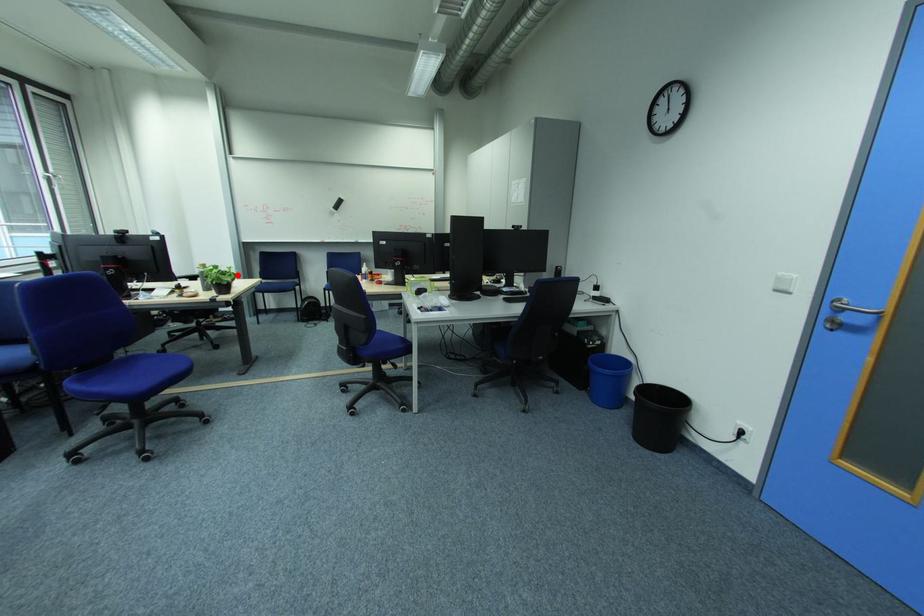
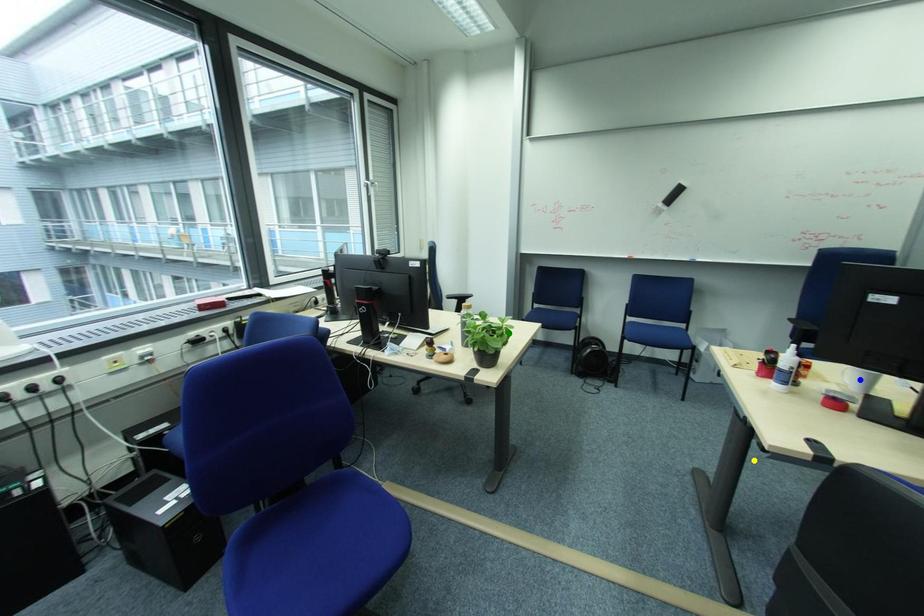
Question: I am providing you with two images of the same scene from different viewpoints. A red point is marked on the first image. You are given multiple points on the second image. Which point in image 2 is actually the same real-world point as the red point in image 1?

Choices:
 (A) green point
 (B) yellow point
 (C) blue point

Answer: (A)